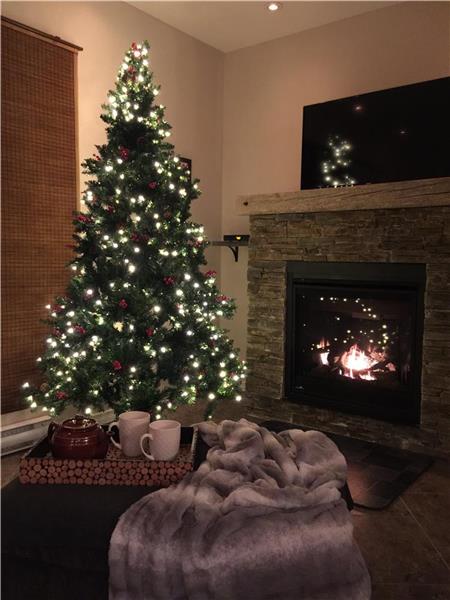
Identify the location of lights. The image size is (450, 600). tap(133, 268).